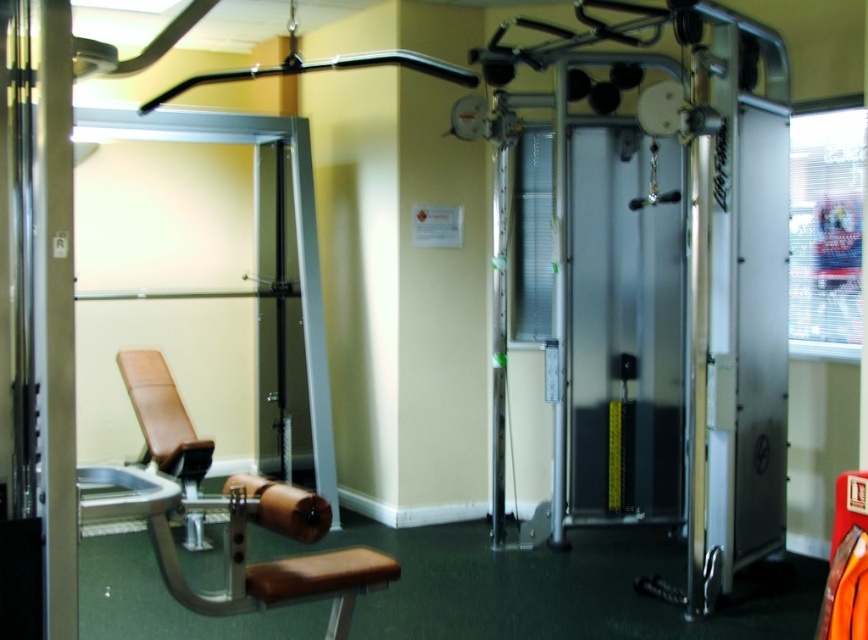
Who is positioned more to the left, brown leather bench at lower left or brown leather bench at lower center?

From the viewer's perspective, brown leather bench at lower left appears more on the left side.

Can you confirm if brown leather bench at lower left is positioned below brown leather bench at lower center?

No.

Which is in front, point (199, 524) or point (386, 564)?

Point (386, 564) is more forward.

Where is `brown leather bench at lower left`? Image resolution: width=868 pixels, height=640 pixels. brown leather bench at lower left is located at coordinates (163, 419).